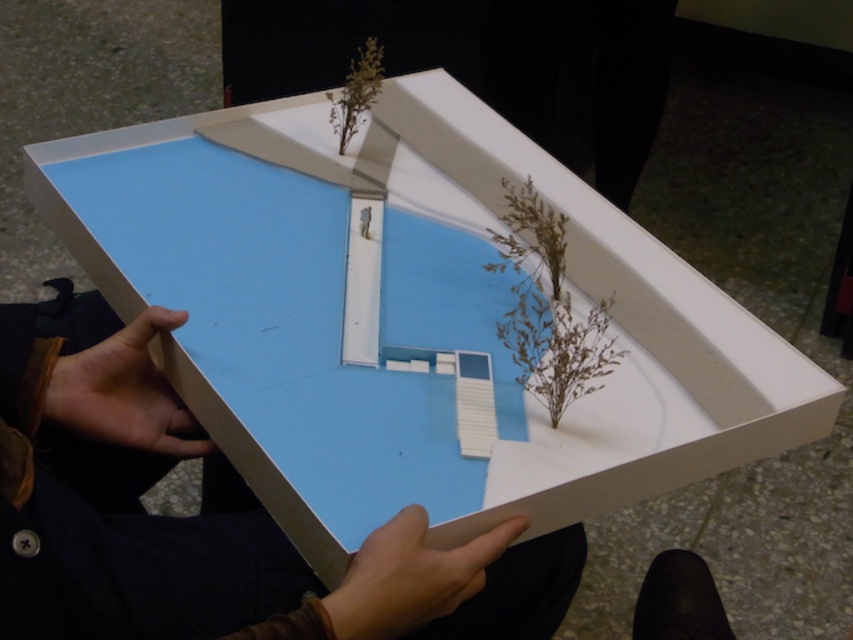
Question: Which point is farther to the camera?

Choices:
 (A) dry grass at upper center
 (B) matte black hand at lower center
 (C) matte white model house at center

Answer: (A)

Question: Is matte white model house at center to the right of matte skin hand at lower left from the viewer's perspective?

Choices:
 (A) yes
 (B) no

Answer: (A)

Question: Which of the following is the closest to the observer?

Choices:
 (A) matte white model house at center
 (B) matte black hand at lower center

Answer: (A)

Question: Can you confirm if matte white model house at center is positioned below brown textured plant at center?

Choices:
 (A) no
 (B) yes

Answer: (B)

Question: Is brown textured plant at center bigger than matte black hand at lower center?

Choices:
 (A) yes
 (B) no

Answer: (A)

Question: Estimate the real-world distances between objects in this image. Which object is closer to the brown textured plant at center?

Choices:
 (A) matte skin hand at lower left
 (B) matte black hand at lower center
 (C) matte white model house at center

Answer: (B)